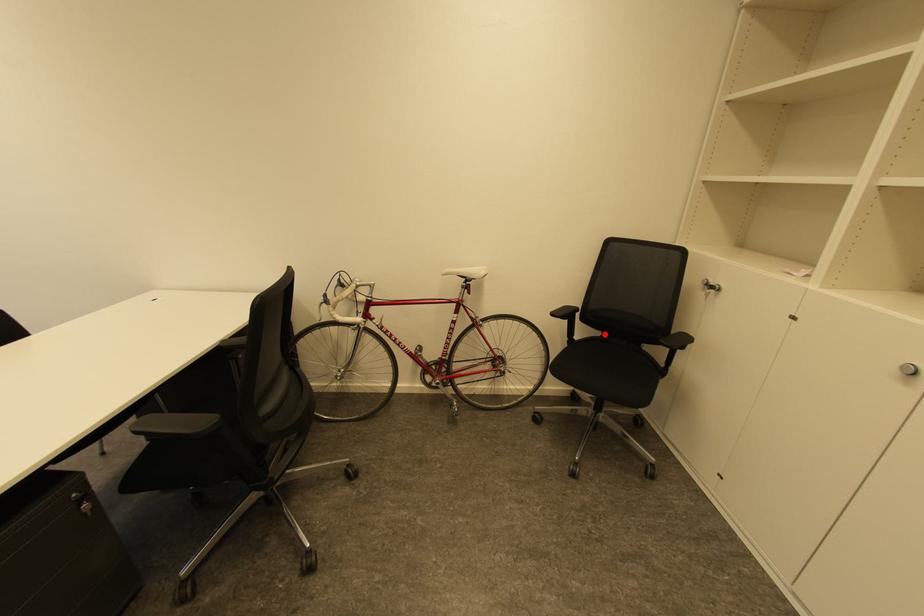
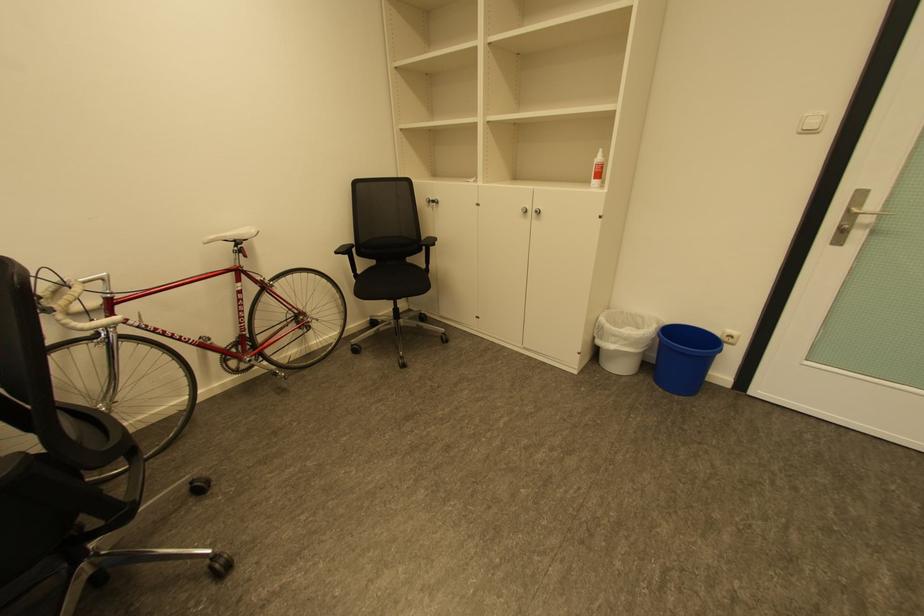
The point at the highlighted location is marked in the first image. Where is the corresponding point in the second image?

(380, 262)